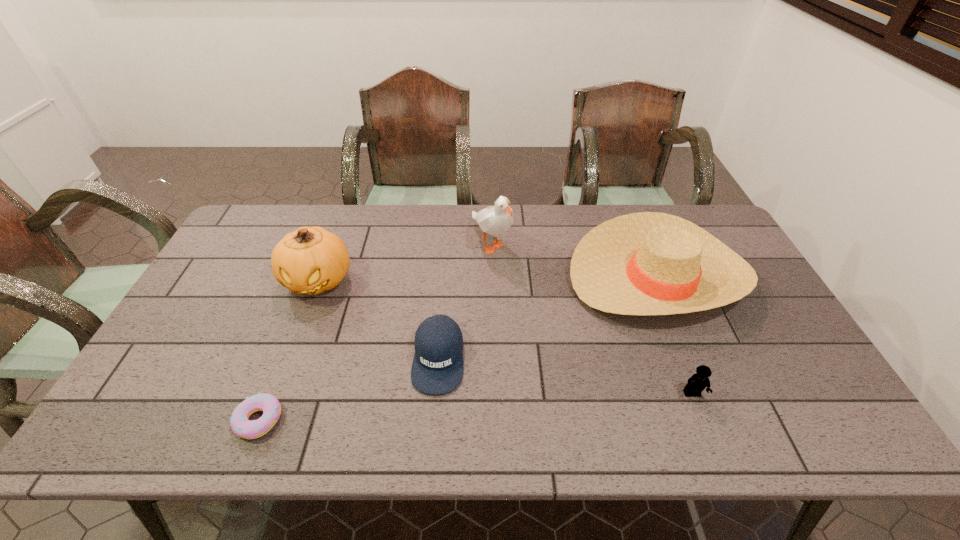
Where is `free space located on the front-facing side of the Lego`? free space located on the front-facing side of the Lego is located at coordinates (710, 442).

The height and width of the screenshot is (540, 960). I want to click on vacant region located 0.060m on the front-facing side of the second shortest object, so click(434, 420).

You are a GUI agent. You are given a task and a screenshot of the screen. Output one action in this format:
    pyautogui.click(x=<x>, y=<y>)
    Task: Click on the free location located on the back of the shortest object
    The height and width of the screenshot is (540, 960).
    Given the screenshot: What is the action you would take?
    coord(311,286)

In order to click on gull at the far edge in this screenshot , I will do `click(495, 221)`.

This screenshot has width=960, height=540. I want to click on sunhat that is at the far edge, so click(x=648, y=263).

Find the location of a particular element. object at the near edge is located at coordinates (269, 404).

Where is `object that is at the right edge`? The width and height of the screenshot is (960, 540). object that is at the right edge is located at coordinates (648, 263).

Find the location of a particular element. object that is at the far right corner is located at coordinates (648, 263).

The image size is (960, 540). I want to click on free space at the far edge of the desktop, so click(x=423, y=222).

The image size is (960, 540). Identify the location of vacant space at the near edge of the desktop. (315, 441).